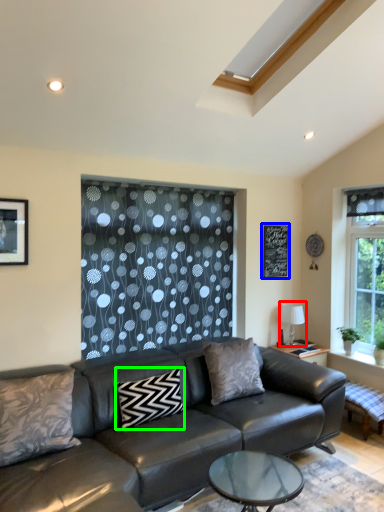
Question: Estimate the real-world distances between objects in this image. Which object is farther from lamp (highlighted by a red box), bulletin board (highlighted by a blue box) or pillow (highlighted by a green box)?

Choices:
 (A) bulletin board
 (B) pillow

Answer: (B)